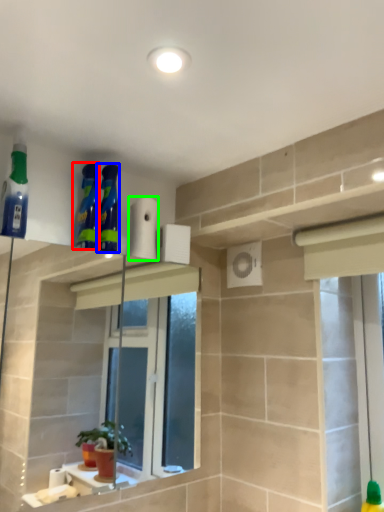
Question: Which object is the farthest from cleaning product (highlighted by a red box)? Choose among these: cleaning product (highlighted by a blue box) or toilet paper (highlighted by a green box).

Choices:
 (A) cleaning product
 (B) toilet paper

Answer: (B)